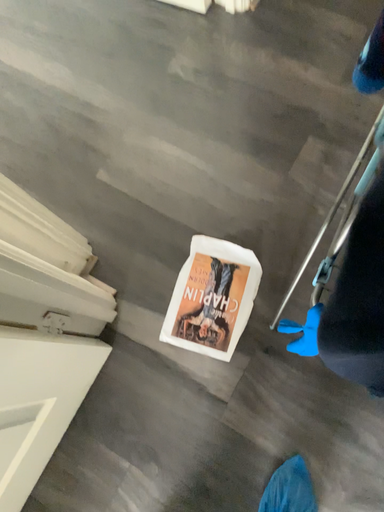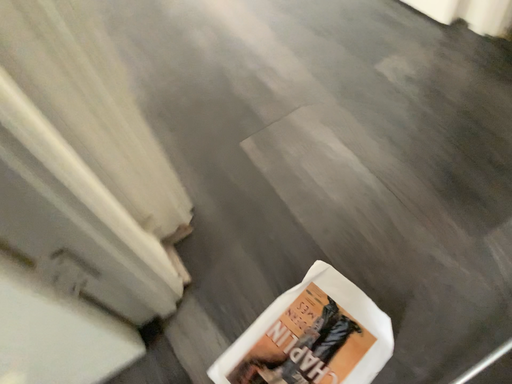
Question: Which way did the camera rotate in the video?

Choices:
 (A) rotated left
 (B) rotated right

Answer: (A)